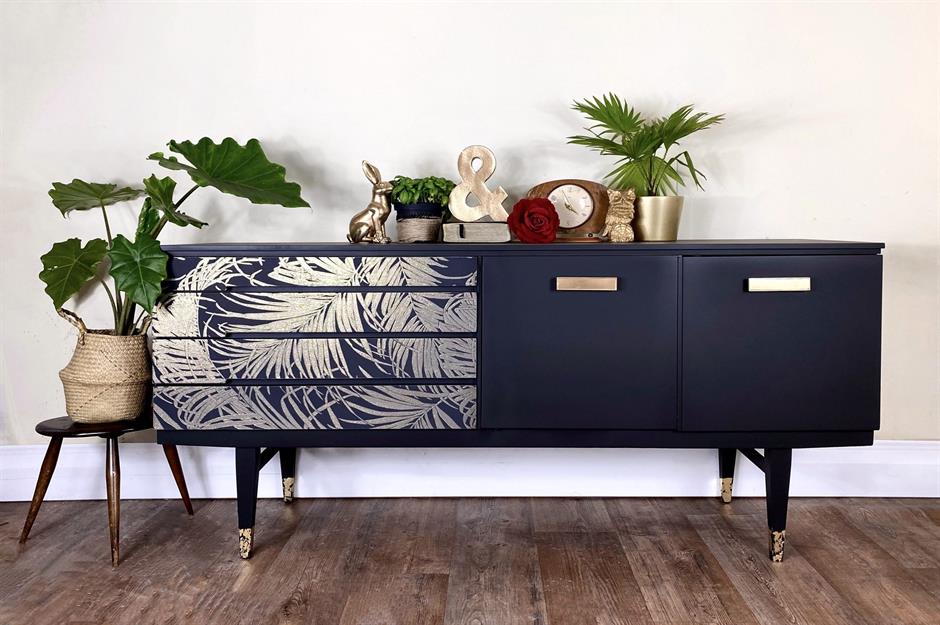
At what (x,y) coordinates should I click in order to perform the action: click on floor. Please return your answer as a coordinate pair (x, y). This screenshot has height=625, width=940. Looking at the image, I should click on (572, 562).